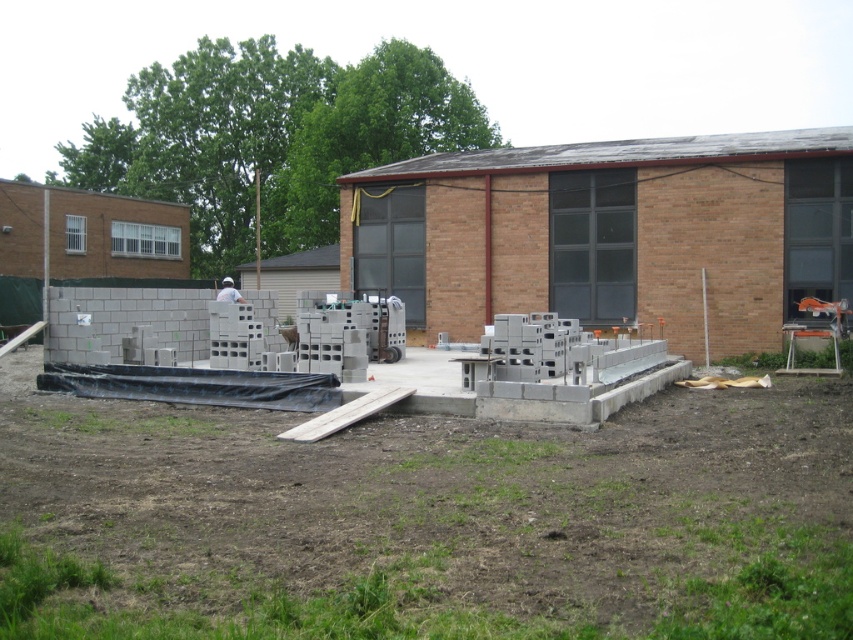
In the scene shown: You are a safety inspector at the construction site. You need to ensure that the gray concrete blocks at center are not taller than the white matte construction worker at center to prevent potential hazards. Is this requirement met based on the scene?

The gray concrete blocks at center is shorter than the white matte construction worker at center, so the requirement is met as the blocks are not taller than the worker.

You are standing at the camera position and want to place a new gray concrete block at center. The block you have is 2 feet wide. Can you determine if there is enough space between the existing gray concrete blocks at center to place your block?

The gray concrete blocks at center is 33.00 feet from camera. Since the block you have is 2 feet wide, you need to ensure there is enough space between the existing blocks. However, the description does not provide information about the spacing between the existing blocks, so it is unclear if there is sufficient space to place the new block.

You are a delivery driver who just arrived at the construction site. You need to unload a pallet of tools near the gray concrete blocks at center and the white matte construction worker at center. Which object should you place the tools closer to if you want them to be near the construction worker?

You should place the tools closer to the white matte construction worker at center because the gray concrete blocks at center are positioned to the right of the worker, meaning the worker is on the left side relative to the blocks.